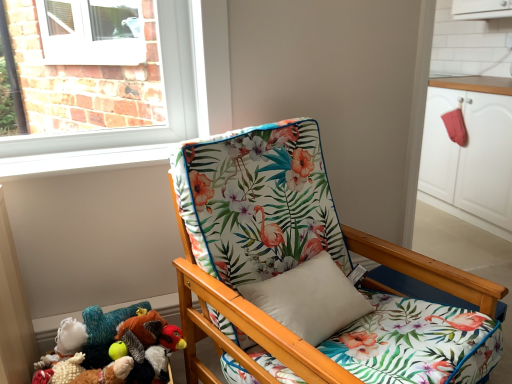
Question: Should I look upward or downward to see white matte cabinet at right?

Choices:
 (A) up
 (B) down

Answer: (A)

Question: From the image's perspective, is floral fabric chair at center on top of white matte cabinet at right?

Choices:
 (A) no
 (B) yes

Answer: (A)

Question: From the image's perspective, would you say floral fabric chair at center is shown under white matte cabinet at right?

Choices:
 (A) no
 (B) yes

Answer: (B)

Question: From a real-world perspective, is floral fabric chair at center located beneath white matte cabinet at right?

Choices:
 (A) yes
 (B) no

Answer: (A)

Question: From a real-world perspective, is floral fabric chair at center located higher than white matte cabinet at right?

Choices:
 (A) yes
 (B) no

Answer: (B)

Question: Is floral fabric chair at center bigger than white matte cabinet at right?

Choices:
 (A) yes
 (B) no

Answer: (B)

Question: Is floral fabric chair at center shorter than white matte cabinet at right?

Choices:
 (A) no
 (B) yes

Answer: (A)

Question: Does fluffy plush toy at lower left, the 2th toy from the left, come behind fluffy white stuffed animal at lower left, marked as the first toy in a left-to-right arrangement?

Choices:
 (A) no
 (B) yes

Answer: (A)

Question: From the image's perspective, is fluffy plush toy at lower left, marked as the 1th toy in a right-to-left arrangement, over fluffy white stuffed animal at lower left, marked as the first toy in a left-to-right arrangement?

Choices:
 (A) yes
 (B) no

Answer: (A)

Question: Is fluffy plush toy at lower left, marked as the 1th toy in a right-to-left arrangement, positioned with its back to fluffy white stuffed animal at lower left, placed as the second toy when sorted from right to left?

Choices:
 (A) yes
 (B) no

Answer: (B)

Question: Considering the relative sizes of fluffy plush toy at lower left, the 2th toy from the left, and fluffy white stuffed animal at lower left, marked as the first toy in a left-to-right arrangement, in the image provided, is fluffy plush toy at lower left, the 2th toy from the left, wider than fluffy white stuffed animal at lower left, marked as the first toy in a left-to-right arrangement,?

Choices:
 (A) no
 (B) yes

Answer: (B)

Question: From a real-world perspective, is fluffy plush toy at lower left, marked as the 1th toy in a right-to-left arrangement, physically above fluffy white stuffed animal at lower left, placed as the second toy when sorted from right to left?

Choices:
 (A) no
 (B) yes

Answer: (B)

Question: Is fluffy plush toy at lower left, marked as the 1th toy in a right-to-left arrangement, to the left of fluffy white stuffed animal at lower left, placed as the second toy when sorted from right to left, from the viewer's perspective?

Choices:
 (A) no
 (B) yes

Answer: (A)

Question: Does white matte cabinet at right have a lesser width compared to fluffy white stuffed animal at lower left, marked as the first toy in a left-to-right arrangement?

Choices:
 (A) yes
 (B) no

Answer: (B)